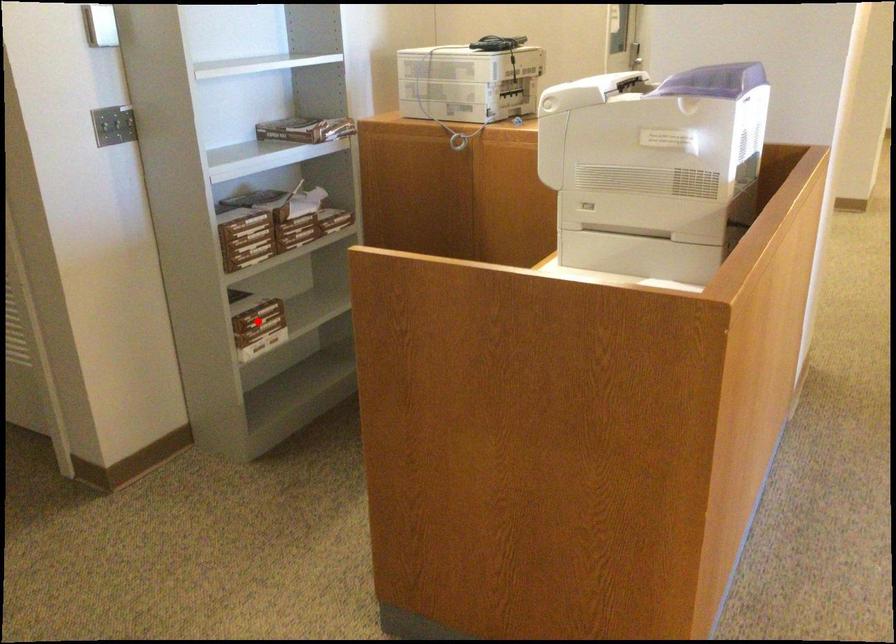
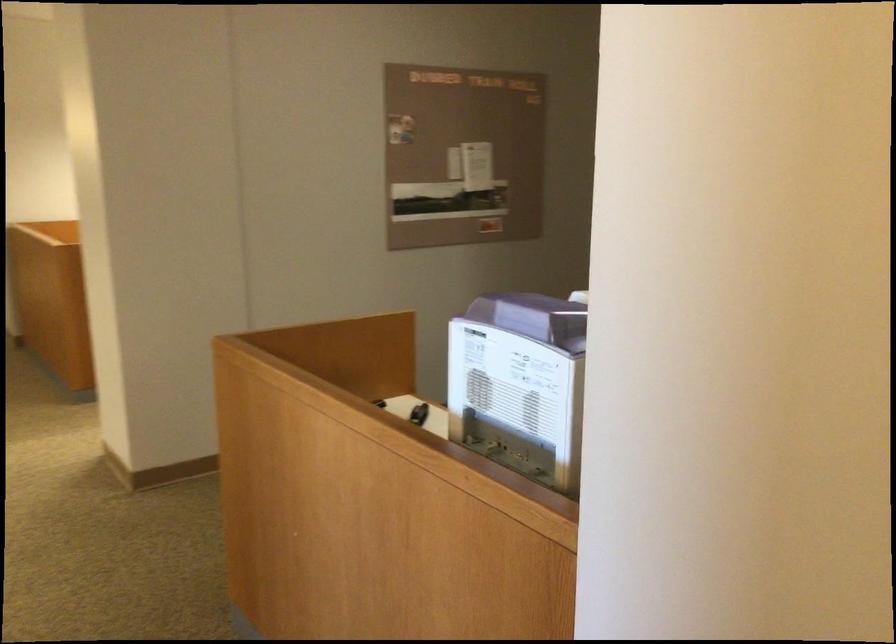
Question: I am providing you with two images of the same scene from different viewpoints. A red point is marked on the first image. At the location where the point appears in image 1, is it still visible in image 2?

Choices:
 (A) Yes
 (B) No

Answer: (B)